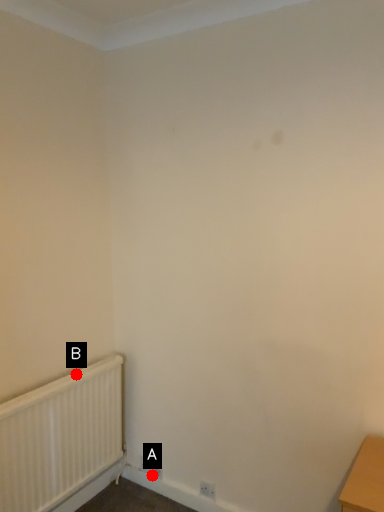
Question: Two points are circled on the image, labeled by A and B beside each circle. Which point is farther to the camera?

Choices:
 (A) A is further
 (B) B is further

Answer: (A)